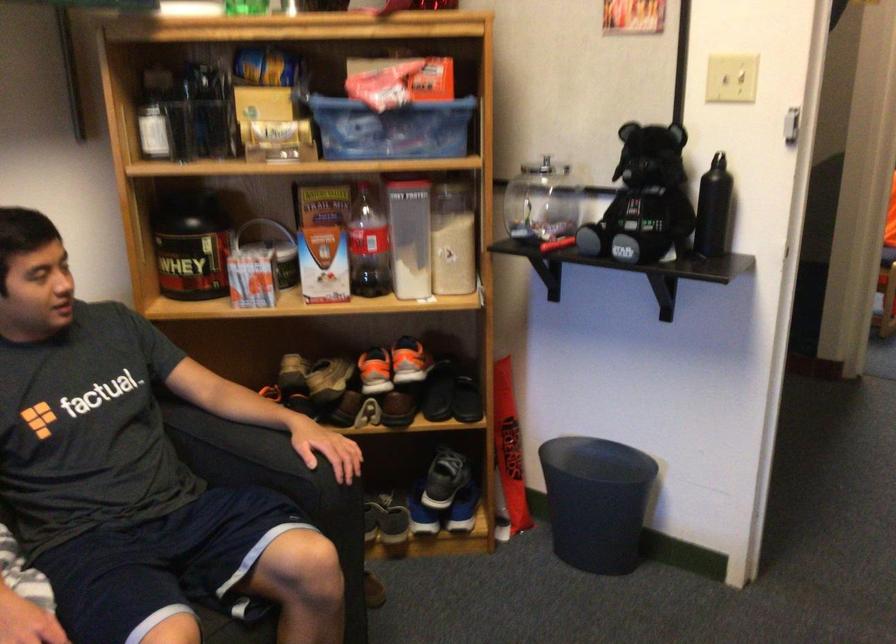
You are a GUI agent. You are given a task and a screenshot of the screen. Output one action in this format:
    pyautogui.click(x=<x>, y=<y>)
    Task: Click on the glass jar lid
    The height and width of the screenshot is (644, 896).
    Given the screenshot: What is the action you would take?
    pyautogui.click(x=547, y=167)